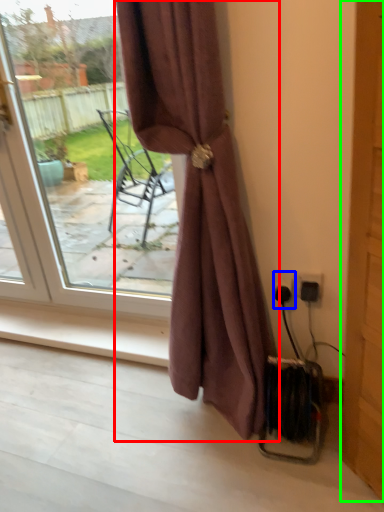
Question: Which is farther away from curtain (highlighted by a red box)? electric outlet (highlighted by a blue box) or screen door (highlighted by a green box)?

Choices:
 (A) electric outlet
 (B) screen door

Answer: (B)